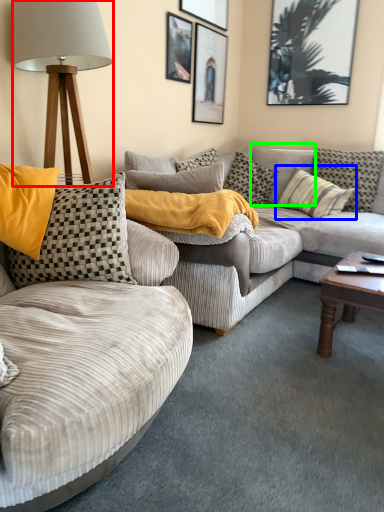
Question: Considering the real-world distances, which object is farthest from lamp (highlighted by a red box)? pillow (highlighted by a blue box) or pillow (highlighted by a green box)?

Choices:
 (A) pillow
 (B) pillow

Answer: (B)